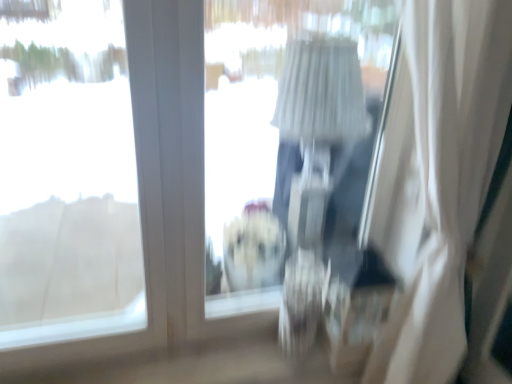
Question: Does transparent glass window at upper left have a lesser width compared to transparent plastic window screen at center?

Choices:
 (A) no
 (B) yes

Answer: (A)

Question: Can you confirm if transparent glass window at upper left is wider than transparent plastic window screen at center?

Choices:
 (A) yes
 (B) no

Answer: (A)

Question: Is transparent glass window at upper left positioned with its back to transparent plastic window screen at center?

Choices:
 (A) yes
 (B) no

Answer: (B)

Question: From the image's perspective, is transparent glass window at upper left below transparent plastic window screen at center?

Choices:
 (A) no
 (B) yes

Answer: (B)

Question: Is transparent glass window at upper left touching transparent plastic window screen at center?

Choices:
 (A) yes
 (B) no

Answer: (B)

Question: From a real-world perspective, is transparent glass window at upper left located beneath transparent plastic window screen at center?

Choices:
 (A) yes
 (B) no

Answer: (A)

Question: From a real-world perspective, is transparent glass window at upper left located beneath white sheer curtain at right?

Choices:
 (A) yes
 (B) no

Answer: (B)

Question: From the image's perspective, would you say transparent glass window at upper left is shown under white sheer curtain at right?

Choices:
 (A) no
 (B) yes

Answer: (A)

Question: Can we say transparent glass window at upper left lies outside white sheer curtain at right?

Choices:
 (A) yes
 (B) no

Answer: (A)

Question: From the image's perspective, would you say transparent glass window at upper left is positioned over white sheer curtain at right?

Choices:
 (A) yes
 (B) no

Answer: (A)

Question: Would you say transparent glass window at upper left is a long distance from white sheer curtain at right?

Choices:
 (A) yes
 (B) no

Answer: (A)

Question: Considering the relative sizes of transparent glass window at upper left and white sheer curtain at right in the image provided, is transparent glass window at upper left smaller than white sheer curtain at right?

Choices:
 (A) no
 (B) yes

Answer: (B)

Question: Can you confirm if transparent plastic window screen at center is taller than white sheer curtain at right?

Choices:
 (A) no
 (B) yes

Answer: (A)